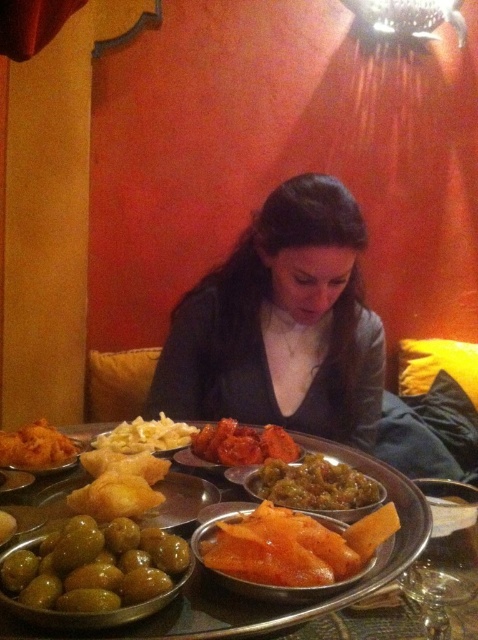
From the picture: What is the location of the green matte sauce at center in the image?

The green matte sauce at center is located at point (315, 484).